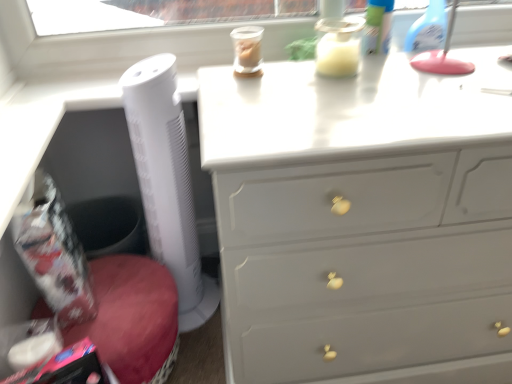
The width and height of the screenshot is (512, 384). Describe the element at coordinates (167, 182) in the screenshot. I see `white plastic tower fan at left` at that location.

Where is `white plastic tower fan at left`? The image size is (512, 384). white plastic tower fan at left is located at coordinates click(x=167, y=182).

This screenshot has height=384, width=512. What do you see at coordinates (362, 218) in the screenshot?
I see `white glossy chest of drawers at upper center` at bounding box center [362, 218].

You are a GUI agent. You are given a task and a screenshot of the screen. Output one action in this format:
    pyautogui.click(x=<x>, y=<y>)
    Task: Click on the white glossy chest of drawers at upper center
    The height and width of the screenshot is (384, 512).
    Given the screenshot: What is the action you would take?
    pyautogui.click(x=362, y=218)

At what (x,y) coordinates should I click in order to perform the action: click on white plastic tower fan at left. Please return your answer as a coordinate pair (x, y). Image resolution: width=512 pixels, height=384 pixels. Looking at the image, I should click on (167, 182).

Is white plastic tower fan at left to the right of white glossy chest of drawers at upper center from the viewer's perspective?

Incorrect, white plastic tower fan at left is not on the right side of white glossy chest of drawers at upper center.

Which object is further away from the camera, white plastic tower fan at left or white glossy chest of drawers at upper center?

white plastic tower fan at left.

Is point (178, 206) positioned after point (401, 64)?

Yes, it is.

From the image's perspective, which is below, white plastic tower fan at left or white glossy chest of drawers at upper center?

white glossy chest of drawers at upper center.

From a real-world perspective, is white plastic tower fan at left positioned above or below white glossy chest of drawers at upper center?

white plastic tower fan at left is above white glossy chest of drawers at upper center.

Which of these two, white plastic tower fan at left or white glossy chest of drawers at upper center, is wider?

With larger width is white glossy chest of drawers at upper center.

Who is taller, white plastic tower fan at left or white glossy chest of drawers at upper center?

With more height is white plastic tower fan at left.

Between white plastic tower fan at left and white glossy chest of drawers at upper center, which one has larger size?

With larger size is white glossy chest of drawers at upper center.

Is white plastic tower fan at left located outside white glossy chest of drawers at upper center?

Yes, white plastic tower fan at left is not within white glossy chest of drawers at upper center.

Is white plastic tower fan at left far away from white glossy chest of drawers at upper center?

No, white plastic tower fan at left is in close proximity to white glossy chest of drawers at upper center.

Is white glossy chest of drawers at upper center at the back of white plastic tower fan at left?

white plastic tower fan at left is not turned away from white glossy chest of drawers at upper center.

How different are the orientations of white plastic tower fan at left and white glossy chest of drawers at upper center in degrees?

0.742 degrees separate the facing orientations of white plastic tower fan at left and white glossy chest of drawers at upper center.

At what (x,y) coordinates should I click in order to perform the action: click on chest of drawers that is on the right side of white plastic tower fan at left. Please return your answer as a coordinate pair (x, y). This screenshot has height=384, width=512. Looking at the image, I should click on (362, 218).

Is white glossy chest of drawers at upper center at the left side of white plastic tower fan at left?

No, white glossy chest of drawers at upper center is not to the left of white plastic tower fan at left.

Considering their positions, is white glossy chest of drawers at upper center located in front of or behind white plastic tower fan at left?

Clearly, white glossy chest of drawers at upper center is in front of white plastic tower fan at left.

Is point (304, 252) positioned behind point (167, 106)?

No.

From the image's perspective, is white glossy chest of drawers at upper center above white plastic tower fan at left?

Actually, white glossy chest of drawers at upper center appears below white plastic tower fan at left in the image.

From a real-world perspective, is white glossy chest of drawers at upper center below white plastic tower fan at left?

Yes, from a real-world perspective, white glossy chest of drawers at upper center is under white plastic tower fan at left.

Which object is wider, white glossy chest of drawers at upper center or white plastic tower fan at left?

Wider between the two is white glossy chest of drawers at upper center.

Considering the sizes of objects white glossy chest of drawers at upper center and white plastic tower fan at left in the image provided, who is shorter, white glossy chest of drawers at upper center or white plastic tower fan at left?

white glossy chest of drawers at upper center.

Considering the relative sizes of white glossy chest of drawers at upper center and white plastic tower fan at left in the image provided, is white glossy chest of drawers at upper center smaller than white plastic tower fan at left?

No, white glossy chest of drawers at upper center is not smaller than white plastic tower fan at left.

Is white plastic tower fan at left completely or partially inside white glossy chest of drawers at upper center?

That's incorrect, white plastic tower fan at left is not inside white glossy chest of drawers at upper center.

Is white glossy chest of drawers at upper center with white plastic tower fan at left?

white glossy chest of drawers at upper center and white plastic tower fan at left are clearly separated.

Could you tell me if white glossy chest of drawers at upper center is facing white plastic tower fan at left?

No.

Identify the location of the chest of drawers located below the white plastic tower fan at left (from the image's perspective). (362, 218).

Find the location of a particular element. the chest of drawers located in front of the white plastic tower fan at left is located at coordinates (362, 218).

Find the location of a particular element. appliance located behind the white glossy chest of drawers at upper center is located at coordinates (167, 182).